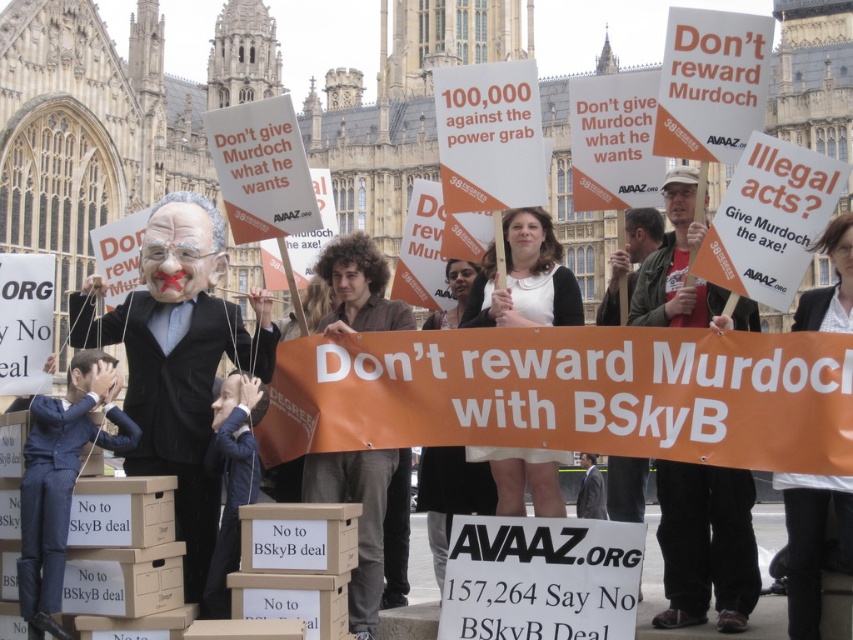
Can you confirm if white fabric dress at center is positioned to the left of white paper sign at center?

Yes, white fabric dress at center is to the left of white paper sign at center.

Measure the distance between point (548, 493) and camera.

Point (548, 493) is 48.77 meters from camera.

You are a GUI agent. You are given a task and a screenshot of the screen. Output one action in this format:
    pyautogui.click(x=<x>, y=<y>)
    Task: Click on the white fabric dress at center
    
    Given the screenshot: What is the action you would take?
    pyautogui.click(x=524, y=278)

Is red shirt at center further to the viewer compared to white paper sign at center?

Yes, red shirt at center is behind white paper sign at center.

Who is shorter, red shirt at center or white paper sign at center?

white paper sign at center

Who is more forward, (738,596) or (838,250)?

Positioned in front is point (738,596).

The width and height of the screenshot is (853, 640). What are the coordinates of `red shirt at center` in the screenshot? It's located at (706, 545).

Does matte black suit at center appear under red shirt at center?

Yes, matte black suit at center is below red shirt at center.

Which of these two, matte black suit at center or red shirt at center, stands shorter?

With less height is matte black suit at center.

Which is behind, point (202, 616) or point (693, 195)?

The point (693, 195) is more distant.

Find the location of a particular element. This screenshot has height=640, width=853. matte black suit at center is located at coordinates (178, 358).